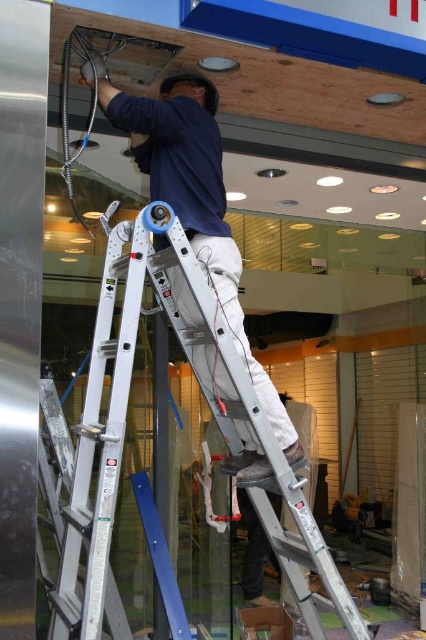
Question: Which point is closer to the camera?

Choices:
 (A) silver/aluminum ladder at center
 (B) dark blue shirt at upper center

Answer: (A)

Question: Which point is closer to the camera?

Choices:
 (A) (258, 499)
 (B) (169, 275)

Answer: (B)

Question: Does silver/aluminum ladder at center appear under dark blue shirt at upper center?

Choices:
 (A) yes
 (B) no

Answer: (A)

Question: Can you confirm if silver/aluminum ladder at center is smaller than dark blue shirt at upper center?

Choices:
 (A) yes
 (B) no

Answer: (B)

Question: Observing the image, what is the correct spatial positioning of silver/aluminum ladder at center in reference to dark blue shirt at upper center?

Choices:
 (A) above
 (B) below

Answer: (B)